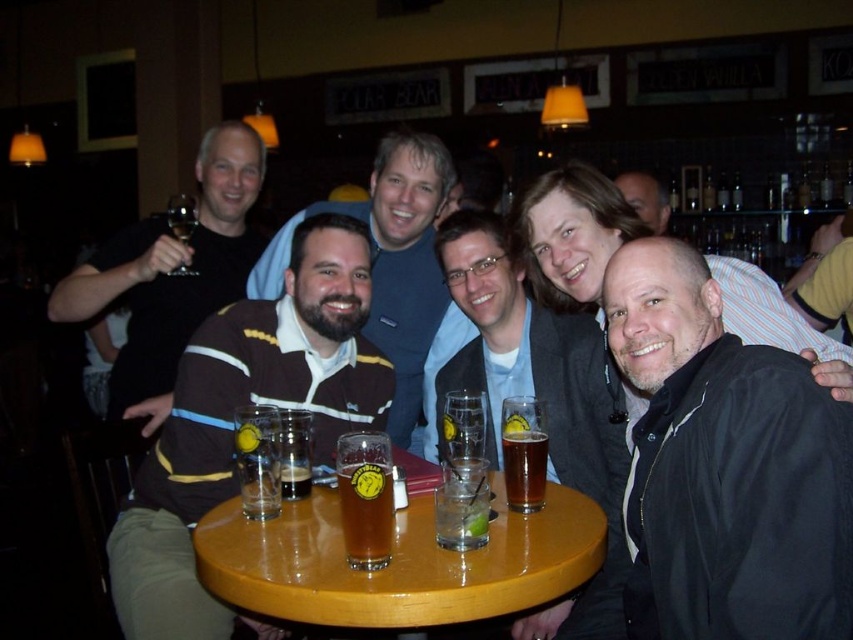
You are a bartender observing the scene. There is a brown jersey at center and a clear glass at table center. Which object is positioned to the right side of the other?

The clear glass at table center is to the right of the brown jersey at center.

You are a bartender at the bar and need to place a new drink order between the brown jersey at center and the brown striped sweater at center. The drink order requires 18 inches of space. Can you fit it there?

The brown jersey at center is 20.51 inches from the brown striped sweater at center. Since the required space is 18 inches, the drink order can be placed between them as there is enough space.